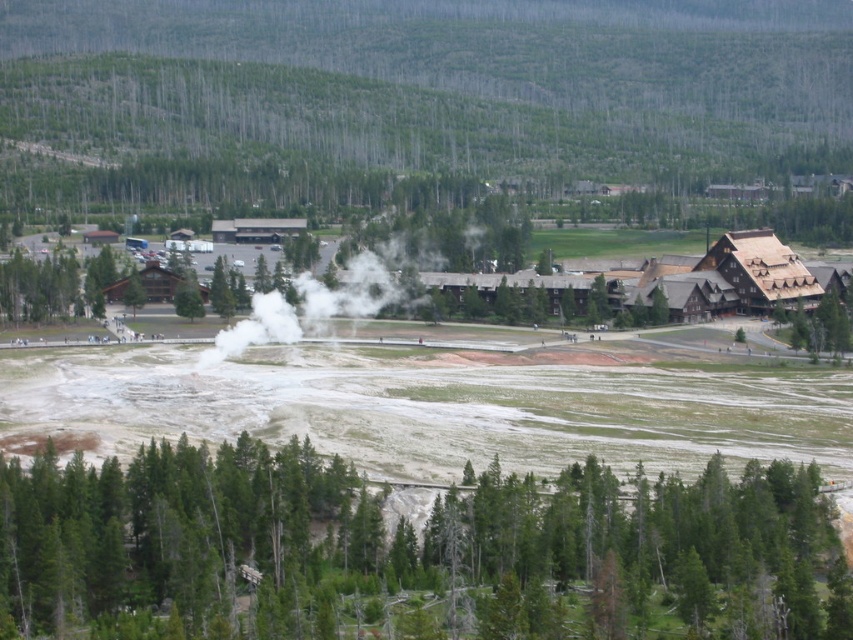
You are a photographer standing at the edge of the geothermal area and want to capture both the steam rising from the dry mineralized area and the wooden structures in the midground. Which of the two points, point (x=294, y=529) or point (x=376, y=307), is nearer to your current position?

A: Point (x=294, y=529) is closer to the camera than point (x=376, y=307), so it is nearer to your current position.

You are a photographer standing at the camera position in the geothermal area scene. You want to capture a closeup shot of the green matte tree at lower left. Given that your telephoto lens can focus on objects up to 80 meters away, will you be able to take the photo without moving closer?

The green matte tree at lower left is 81.79 meters away from the camera. Since the telephoto lens can only focus up to 80 meters, you will not be able to take a clear closeup shot without moving closer.

You are a park ranger walking from the steam rising from the dry area to the wooden structures. Which tree, the green textured trees at lower center or the green matte tree at center, will you pass first?

You will pass the green matte tree at center first because the green textured trees at lower center are to the right of it, meaning the green matte tree at center is closer to your starting point near the steam.